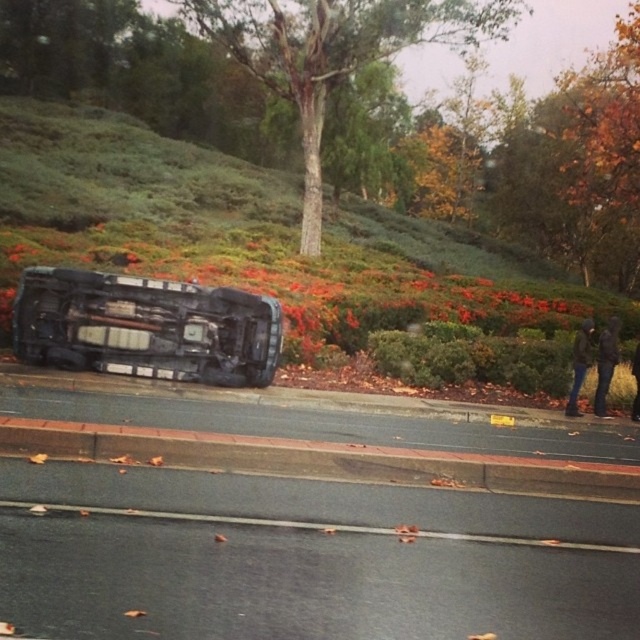
From the picture: You are standing at the point closer to you between the two points, point (248, 320) and point (332, 412). Which point are you standing at?

You are standing at point (248, 320) because it is closer to the viewer than point (332, 412).

You are a rescue worker assessing the overturned vehicle scene. You need to determine if the green shrubbery at upper left is within a safe distance of 60 feet to set up a temporary command center. Can it be placed there?

The green shrubbery at upper left is 58.08 feet away from the viewer, which is within the 60 feet safety distance. Therefore, the temporary command center can be set up there.

You are a drone operator trying to capture an aerial view of the overturned vehicle. You need to position your drone to avoid the green shrubbery at upper left. Where should you direct your drone to fly?

The green shrubbery at upper left is located at point (252,236). To avoid it, direct the drone to fly away from that coordinate, perhaps towards the lower right area of the scene where there is more open space.